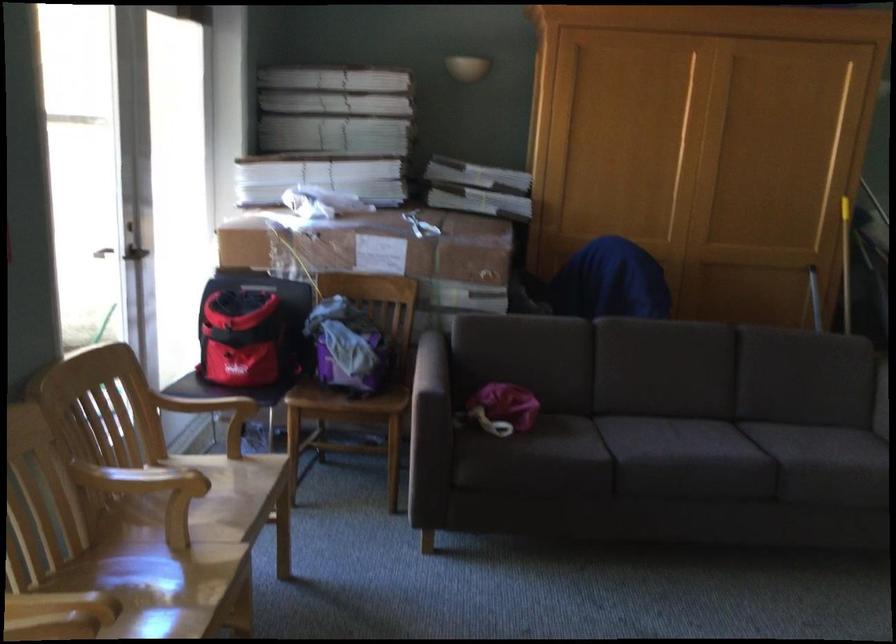
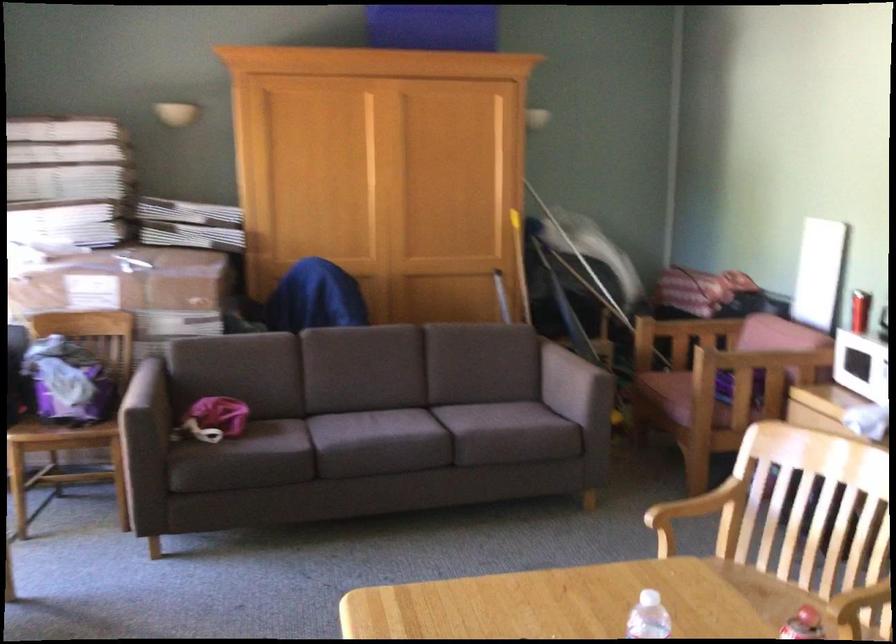
The point at (416, 251) is marked in the first image. Where is the corresponding point in the second image?

(131, 290)